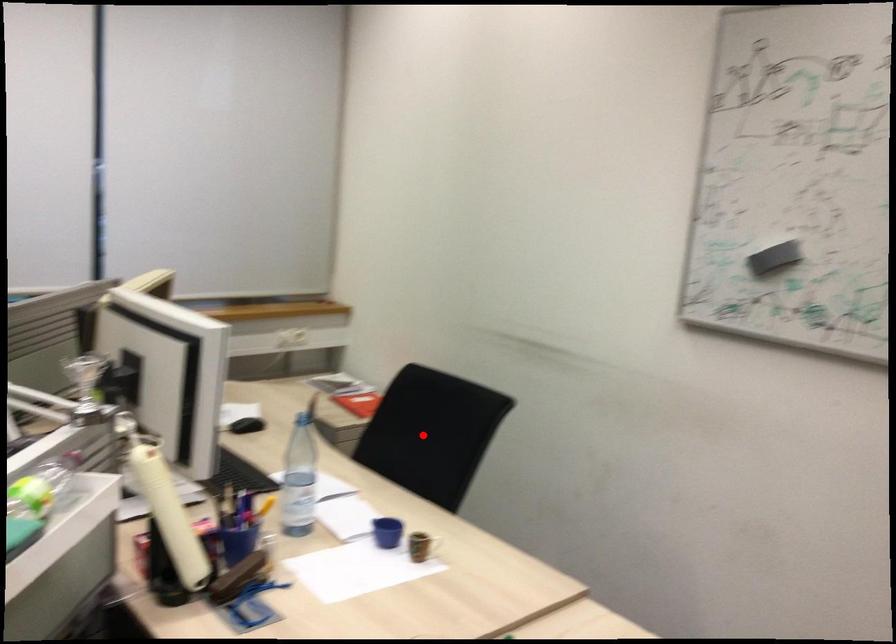
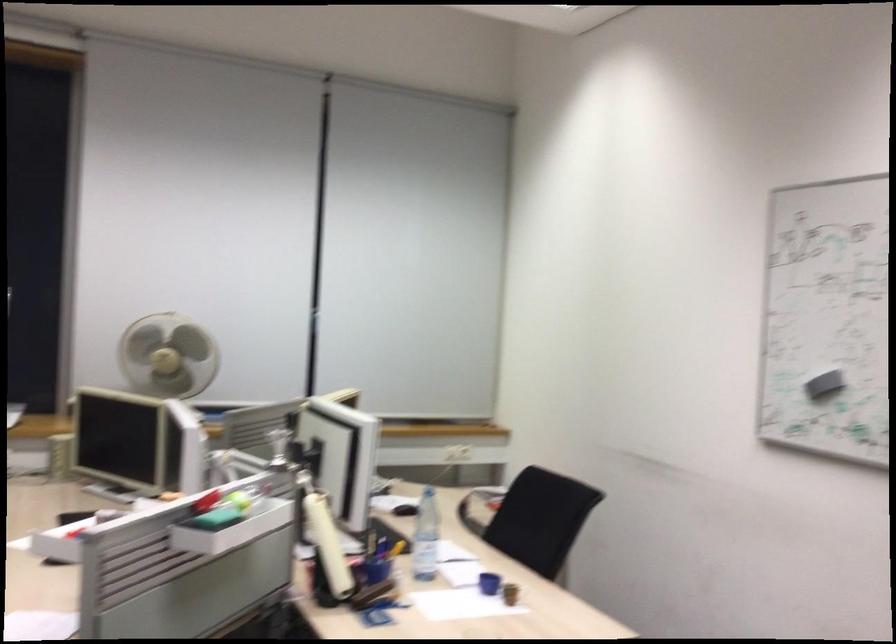
The point at the highlighted location is marked in the first image. Where is the corresponding point in the second image?

(531, 518)